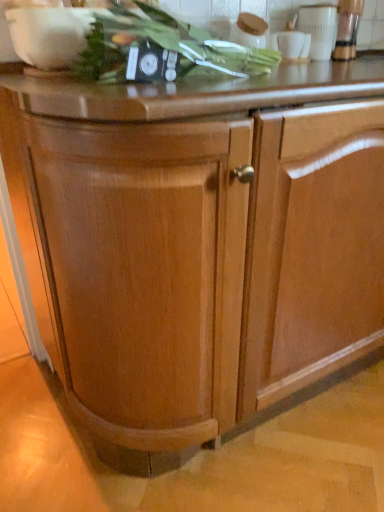
Question: Based on their sizes in the image, would you say metallic silver blender at upper right, the second appliance in the left-to-right sequence, is bigger or smaller than green leafy vegetable at upper center?

Choices:
 (A) big
 (B) small

Answer: (B)

Question: Relative to green leafy vegetable at upper center, is metallic silver blender at upper right, arranged as the first appliance when viewed from the right, in front or behind?

Choices:
 (A) behind
 (B) front

Answer: (A)

Question: Which of these objects is positioned closest to the white glossy cup at upper right, which is the 1th appliance from left to right?

Choices:
 (A) green leafy vegetable at upper center
 (B) metallic silver blender at upper right, arranged as the first appliance when viewed from the right

Answer: (B)

Question: Estimate the real-world distances between objects in this image. Which object is farther from the white glossy cup at upper right, which is counted as the 2th appliance, starting from the right?

Choices:
 (A) metallic silver blender at upper right, the second appliance in the left-to-right sequence
 (B) green leafy vegetable at upper center

Answer: (B)